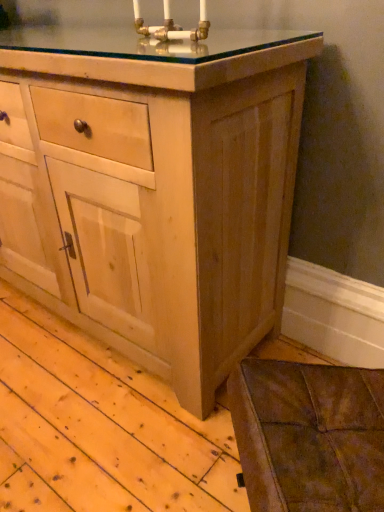
Question: Is gold brass candle holder at upper center positioned with its back to natural wood cabinet at center?

Choices:
 (A) no
 (B) yes

Answer: (A)

Question: Is gold brass candle holder at upper center in front of natural wood cabinet at center?

Choices:
 (A) yes
 (B) no

Answer: (B)

Question: Can you confirm if gold brass candle holder at upper center is positioned to the left of natural wood cabinet at center?

Choices:
 (A) no
 (B) yes

Answer: (A)

Question: Is gold brass candle holder at upper center far away from natural wood cabinet at center?

Choices:
 (A) no
 (B) yes

Answer: (A)

Question: From a real-world perspective, is gold brass candle holder at upper center physically above natural wood cabinet at center?

Choices:
 (A) yes
 (B) no

Answer: (A)

Question: Is the position of gold brass candle holder at upper center more distant than that of natural wood cabinet at center?

Choices:
 (A) no
 (B) yes

Answer: (B)

Question: Does natural wood cabinet at center appear on the left side of gold brass candle holder at upper center?

Choices:
 (A) no
 (B) yes

Answer: (B)

Question: Is natural wood cabinet at center far from gold brass candle holder at upper center?

Choices:
 (A) yes
 (B) no

Answer: (B)

Question: Is natural wood cabinet at center facing towards gold brass candle holder at upper center?

Choices:
 (A) yes
 (B) no

Answer: (B)

Question: Is natural wood cabinet at center at the right side of gold brass candle holder at upper center?

Choices:
 (A) yes
 (B) no

Answer: (B)

Question: Is the depth of natural wood cabinet at center greater than that of gold brass candle holder at upper center?

Choices:
 (A) no
 (B) yes

Answer: (A)

Question: Could gold brass candle holder at upper center be considered to be inside natural wood cabinet at center?

Choices:
 (A) yes
 (B) no

Answer: (B)

Question: Considering the positions of natural wood cabinet at center and gold brass candle holder at upper center in the image, is natural wood cabinet at center taller or shorter than gold brass candle holder at upper center?

Choices:
 (A) short
 (B) tall

Answer: (B)